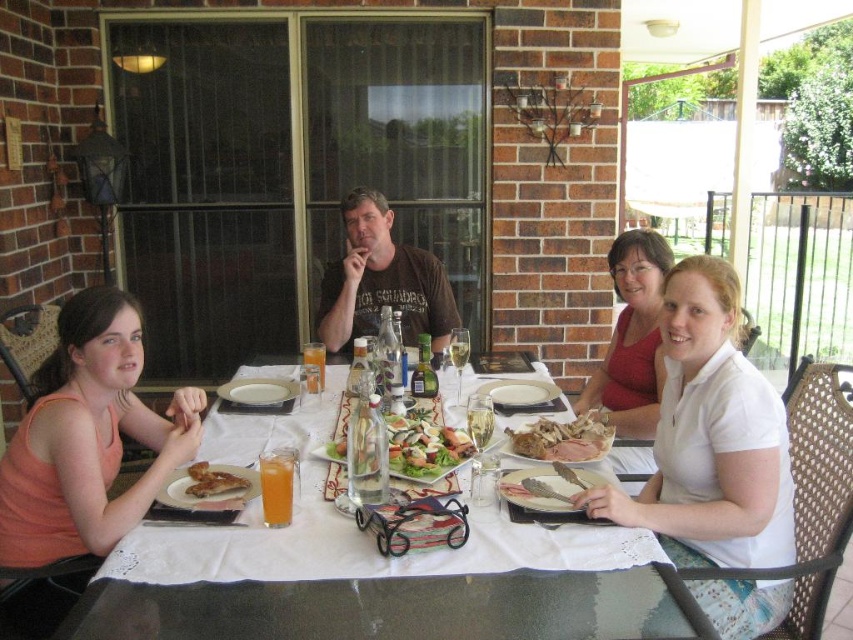
Who is shorter, orange fabric shirt at left or golden brown roasted meat at center?

golden brown roasted meat at center is shorter.

Between orange fabric shirt at left and golden brown roasted meat at center, which one is positioned lower?

golden brown roasted meat at center is below.

Find the location of a particular element. The image size is (853, 640). orange fabric shirt at left is located at coordinates (86, 436).

Does brown cotton shirt at center have a greater height compared to matte white shirt at center?

No.

In the scene shown: Is brown cotton shirt at center to the right of matte white shirt at center from the viewer's perspective?

In fact, brown cotton shirt at center is to the left of matte white shirt at center.

Between point (366, 269) and point (627, 317), which one is positioned behind?

The point (366, 269) is behind.

Identify the location of brown cotton shirt at center. (381, 280).

Which of these two, orange fabric shirt at left or matte white shirt at center, stands taller?

matte white shirt at center

Is point (30, 428) farther from viewer compared to point (618, 408)?

That is False.

The height and width of the screenshot is (640, 853). Find the location of `orange fabric shirt at left`. orange fabric shirt at left is located at coordinates (86, 436).